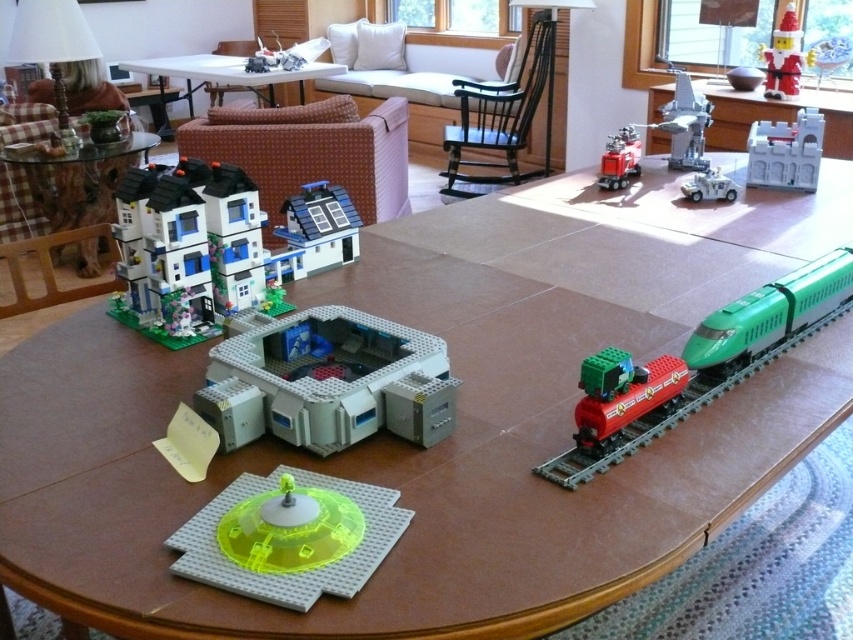
At what (x,y) coordinates should I click in order to perform the action: click on green plastic train at right. Please return your answer as a coordinate pair (x, y). The image size is (853, 640). Looking at the image, I should click on (770, 314).

Is green plastic train at right thinner than white plastic castle at upper right?

In fact, green plastic train at right might be wider than white plastic castle at upper right.

The image size is (853, 640). Describe the element at coordinates (770, 314) in the screenshot. I see `green plastic train at right` at that location.

This screenshot has width=853, height=640. Identify the location of green plastic train at right. (770, 314).

Is translucent plastic building at center smaller than matte plastic house at upper left?

Indeed, translucent plastic building at center has a smaller size compared to matte plastic house at upper left.

Is translucent plastic building at center positioned before matte plastic house at upper left?

Yes, it is in front of matte plastic house at upper left.

Which is behind, point (434, 376) or point (149, 262)?

The point (149, 262) is behind.

What are the coordinates of `translucent plastic building at center` in the screenshot? It's located at (328, 381).

Does green matte train car at center-right have a lesser width compared to metallic silver spaceship at upper right?

Yes.

Does point (608, 356) come farther from viewer compared to point (685, 132)?

No, it is not.

At what (x,y) coordinates should I click in order to perform the action: click on green matte train car at center-right. Please return your answer as a coordinate pair (x, y). Looking at the image, I should click on (621, 392).

You are a GUI agent. You are given a task and a screenshot of the screen. Output one action in this format:
    pyautogui.click(x=<x>, y=<y>)
    Task: Click on the green matte train car at center-right
    The height and width of the screenshot is (640, 853).
    Given the screenshot: What is the action you would take?
    pos(621,392)